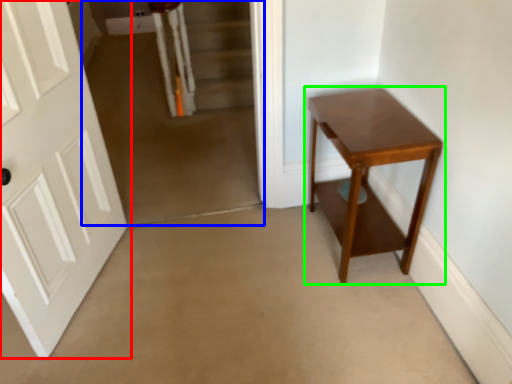
Question: Based on their relative distances, which object is nearer to door (highlighted by a red box)? Choose from corridor (highlighted by a blue box) and table (highlighted by a green box).

Choices:
 (A) corridor
 (B) table

Answer: (A)